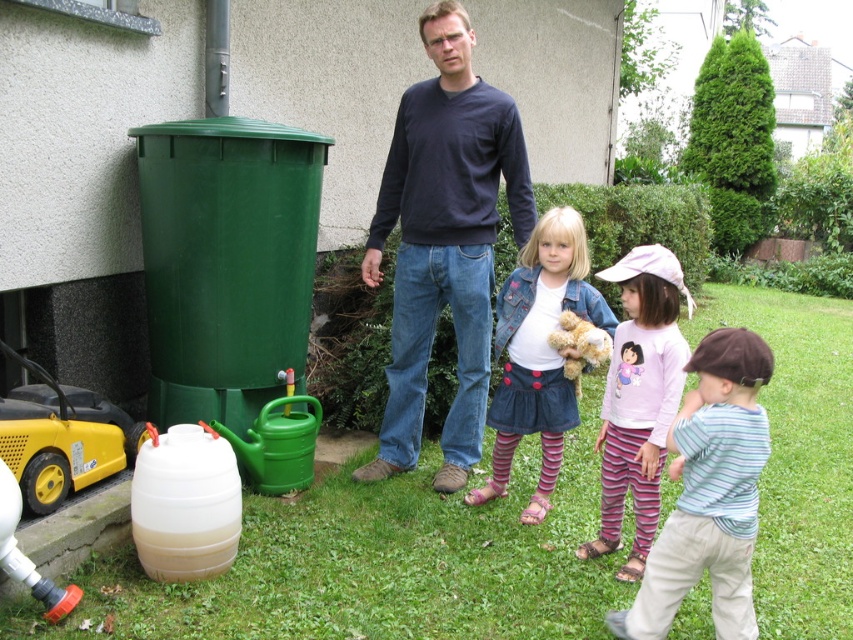
You are standing at the position of the man in the scene. You want to walk to the point labeled as point (656, 336). To do so, should you walk towards the point (741, 458) or away from it?

You should walk towards point (741, 458) because point (656, 336) is behind point (741, 458), so moving toward the latter will bring you closer to the former.

You are a tailor who needs to determine which pair of striped cotton pants requires more fabric for alterations. Based on the image, which of the two striped cotton pants at center or striped cotton pants at lower right requires more fabric due to its larger width?

The striped cotton pants at center requires more fabric for alterations because its width is larger than the striped cotton pants at lower right.